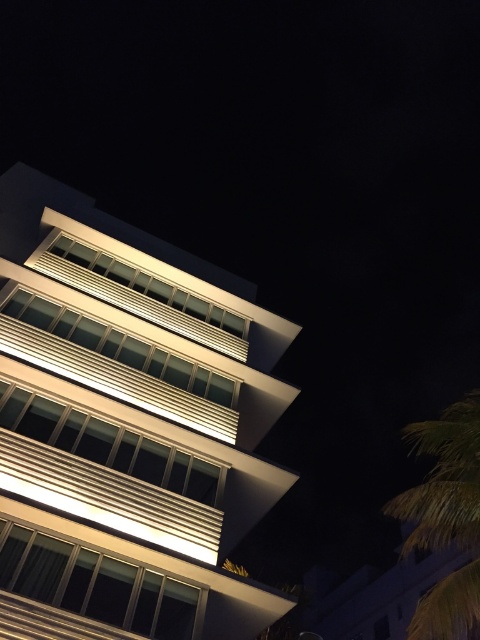
Question: Is white glossy building at center smaller than green leafy palm tree at lower right?

Choices:
 (A) yes
 (B) no

Answer: (A)

Question: Is white glossy building at center below green leafy palm tree at lower right?

Choices:
 (A) yes
 (B) no

Answer: (B)

Question: Can you confirm if white glossy building at center is positioned below green leafy palm tree at lower right?

Choices:
 (A) no
 (B) yes

Answer: (A)

Question: Among these points, which one is farthest from the camera?

Choices:
 (A) (464, 579)
 (B) (46, 236)

Answer: (B)